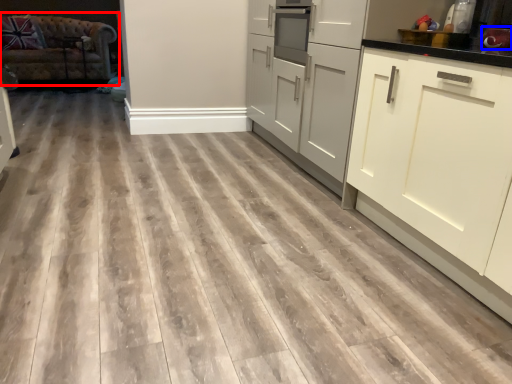
Question: Among these objects, which one is farthest to the camera, studio couch (highlighted by a red box) or appliance (highlighted by a blue box)?

Choices:
 (A) studio couch
 (B) appliance

Answer: (A)